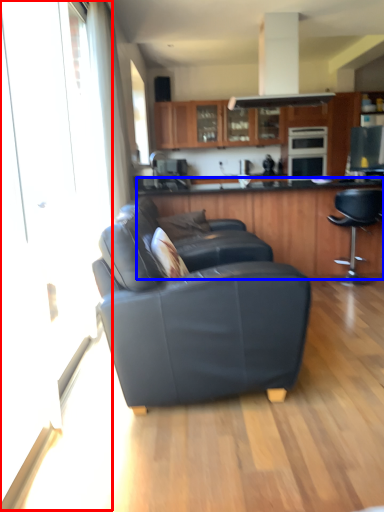
Question: Which point is further to the camera, screen door (highlighted by a red box) or cabinetry (highlighted by a blue box)?

Choices:
 (A) screen door
 (B) cabinetry

Answer: (B)